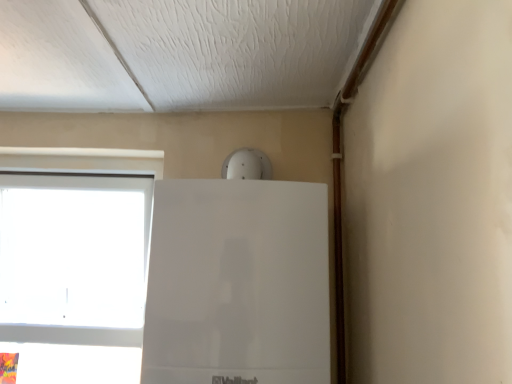
Question: Is white plastic window at left positioned before white glossy fridge at upper center?

Choices:
 (A) yes
 (B) no

Answer: (B)

Question: Is white plastic window at left to the right of white glossy fridge at upper center from the viewer's perspective?

Choices:
 (A) yes
 (B) no

Answer: (B)

Question: Is white glossy fridge at upper center at the back of white plastic window at left?

Choices:
 (A) yes
 (B) no

Answer: (B)

Question: From the image's perspective, is white plastic window at left beneath white glossy fridge at upper center?

Choices:
 (A) yes
 (B) no

Answer: (A)

Question: Considering the relative sizes of white plastic window at left and white glossy fridge at upper center in the image provided, is white plastic window at left taller than white glossy fridge at upper center?

Choices:
 (A) yes
 (B) no

Answer: (A)

Question: Is white plastic window at left wider than white glossy fridge at upper center?

Choices:
 (A) no
 (B) yes

Answer: (A)

Question: Can you confirm if white glossy fridge at upper center is positioned to the right of white plastic window at left?

Choices:
 (A) no
 (B) yes

Answer: (B)

Question: Is white glossy fridge at upper center shorter than white plastic window at left?

Choices:
 (A) no
 (B) yes

Answer: (B)

Question: Is white glossy fridge at upper center far from white plastic window at left?

Choices:
 (A) yes
 (B) no

Answer: (B)

Question: Can you confirm if white glossy fridge at upper center is taller than white plastic window at left?

Choices:
 (A) no
 (B) yes

Answer: (A)

Question: Is white glossy fridge at upper center to the left of white plastic window at left from the viewer's perspective?

Choices:
 (A) yes
 (B) no

Answer: (B)

Question: From a real-world perspective, is white glossy fridge at upper center positioned under white plastic window at left based on gravity?

Choices:
 (A) yes
 (B) no

Answer: (B)

Question: Considering the positions of point (29, 152) and point (318, 258), is point (29, 152) closer or farther from the camera than point (318, 258)?

Choices:
 (A) closer
 (B) farther

Answer: (B)